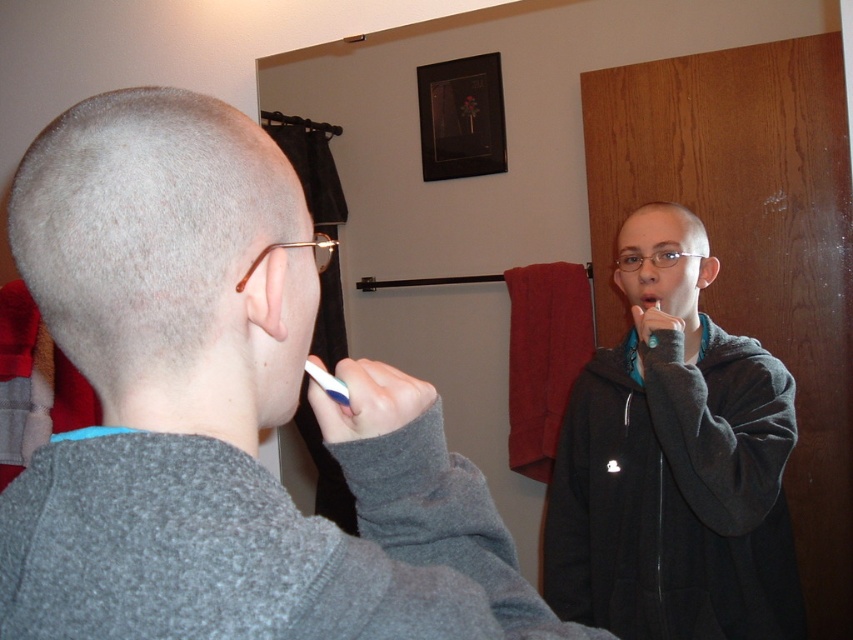
Question: Estimate the real-world distances between objects in this image. Which object is closer to the matte plastic mouth at center?

Choices:
 (A) gray matte sweatshirt at upper left
 (B) black fleece sweatshirt at right

Answer: (B)

Question: Which object is farther from the camera taking this photo?

Choices:
 (A) white plastic toothbrush at left
 (B) black fleece sweatshirt at right
 (C) gray matte sweatshirt at upper left

Answer: (B)

Question: Does black fleece sweatshirt at right have a smaller size compared to matte plastic mouth at center?

Choices:
 (A) yes
 (B) no

Answer: (B)

Question: Does gray matte sweatshirt at upper left have a larger size compared to white plastic toothbrush at left?

Choices:
 (A) no
 (B) yes

Answer: (B)

Question: In this image, where is black fleece sweatshirt at right located relative to white plastic toothbrush at left?

Choices:
 (A) above
 (B) below

Answer: (B)

Question: Which object is the closest to the gray matte sweatshirt at upper left?

Choices:
 (A) matte plastic mouth at center
 (B) white plastic toothbrush at left

Answer: (B)